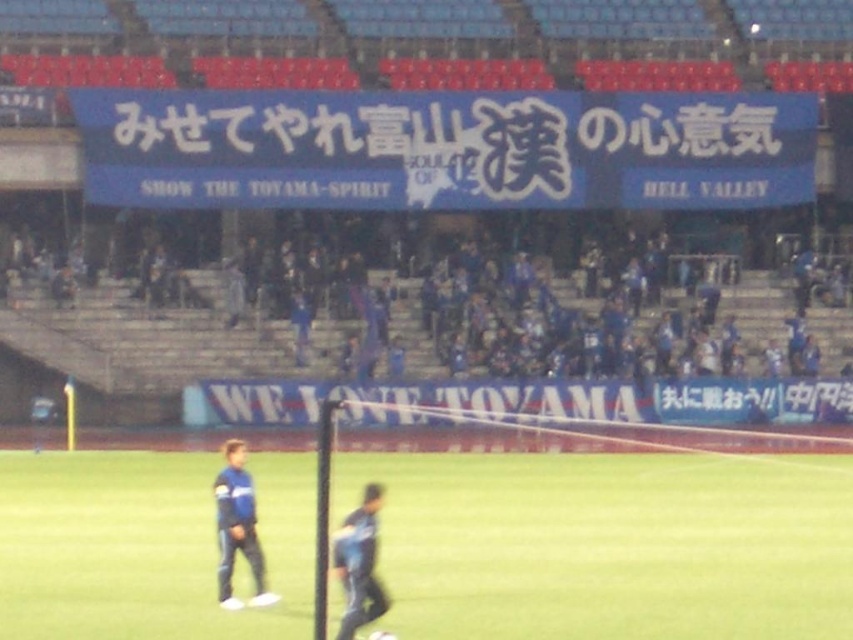
Question: Is green grass field at center above blue fabric at upper center?

Choices:
 (A) yes
 (B) no

Answer: (B)

Question: Estimate the real-world distances between objects in this image. Which object is closer to the green grass field at center?

Choices:
 (A) blue fabric shirt at lower left
 (B) blue fabric pants at lower center
 (C) blue fabric at upper center

Answer: (B)

Question: Can you confirm if green grass field at center is wider than blue fabric pants at lower center?

Choices:
 (A) yes
 (B) no

Answer: (A)

Question: Which point is closer to the camera?

Choices:
 (A) blue fabric at upper center
 (B) green grass field at center
 (C) blue fabric shirt at lower left

Answer: (B)

Question: Is green grass field at center further to the viewer compared to blue fabric at upper center?

Choices:
 (A) no
 (B) yes

Answer: (A)

Question: Which point is farther from the camera taking this photo?

Choices:
 (A) (247, 548)
 (B) (648, 280)
 (C) (289, 636)
 (D) (357, 596)

Answer: (B)